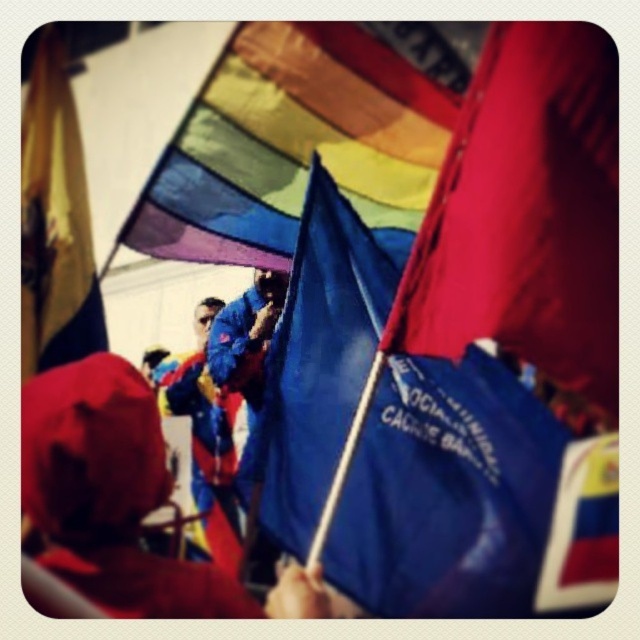
You are attending an outdoor event under a white canopy. You see the rainbow fabric flag at upper center and the yellow fabric flag at left. Which flag is higher in the image?

The rainbow fabric flag at upper center is higher because it is positioned over the yellow fabric flag at left.

You are at an outdoor event and notice two items in the scene. One is the red fabric hat at lower left and the other is the polished plastic flag at lower right. Which item is positioned lower in the image?

The red fabric hat at lower left is positioned lower in the image than the polished plastic flag at lower right.

You are standing at the center of the image and want to locate the blue fabric flag at center. Which direction should you look to find it?

The blue fabric flag at center is located at point (448, 492), which is slightly to the right and slightly below the center of the image. So you should look to the bottom right direction to find it.